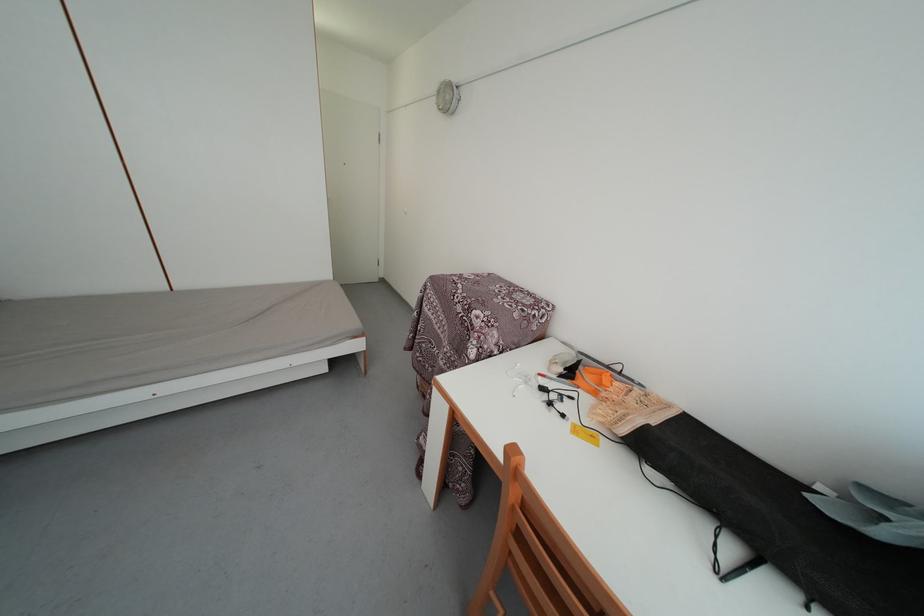
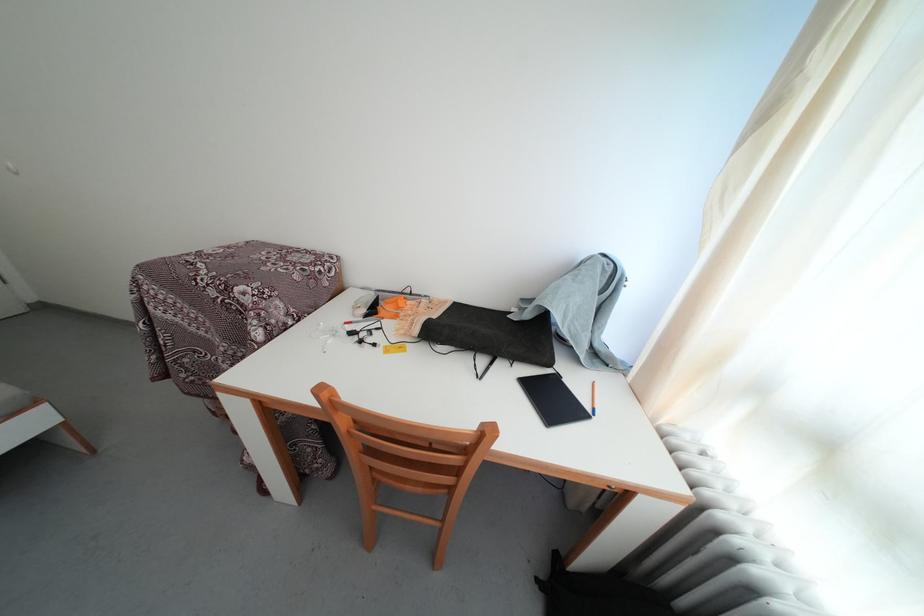
The point at (891, 540) is marked in the first image. Where is the corresponding point in the second image?

(533, 322)